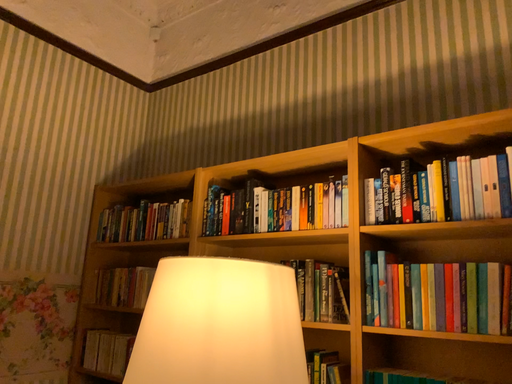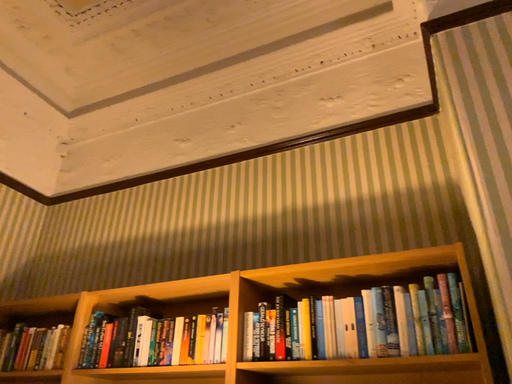
Question: Which way did the camera rotate in the video?

Choices:
 (A) rotated left
 (B) rotated right

Answer: (B)